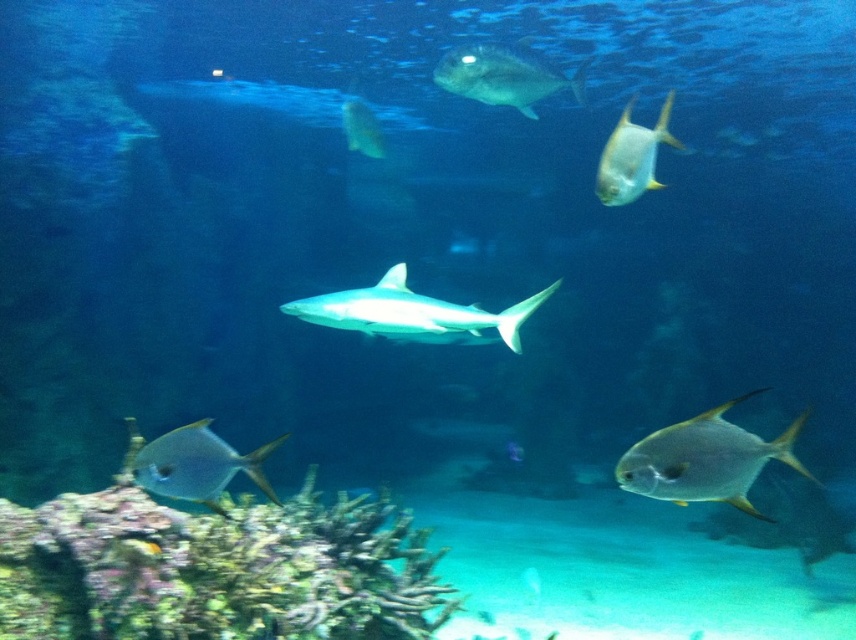
Question: Which point is closer to the camera?

Choices:
 (A) (444, 58)
 (B) (670, 477)
 (C) (391, 323)
 (D) (94, 621)

Answer: (B)

Question: Estimate the real-world distances between objects in this image. Which object is closer to the green coral reef at lower left?

Choices:
 (A) shiny silver fish at lower left
 (B) translucent yellowish fish at upper center

Answer: (A)

Question: Which point is farther to the camera?

Choices:
 (A) (749, 481)
 (B) (254, 449)
 (C) (413, 572)

Answer: (B)

Question: Where is green coral reef at lower left located in relation to translucent yellowish fish at upper center in the image?

Choices:
 (A) below
 (B) above

Answer: (A)

Question: Is shiny silver fish at upper center positioned at the back of shiny silver fish at upper right?

Choices:
 (A) no
 (B) yes

Answer: (B)

Question: Does smooth gray shark at center have a lesser width compared to translucent yellowish fish at upper center?

Choices:
 (A) no
 (B) yes

Answer: (A)